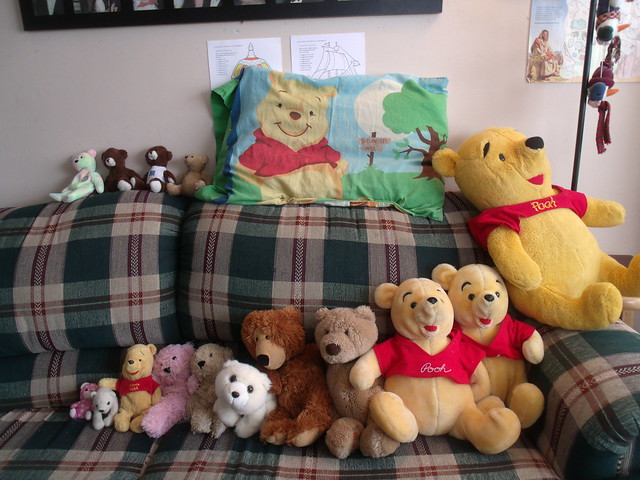
Where is `winnie the pooh teddy bears`? This screenshot has width=640, height=480. winnie the pooh teddy bears is located at coordinates (557, 224), (509, 348), (429, 367), (130, 377).